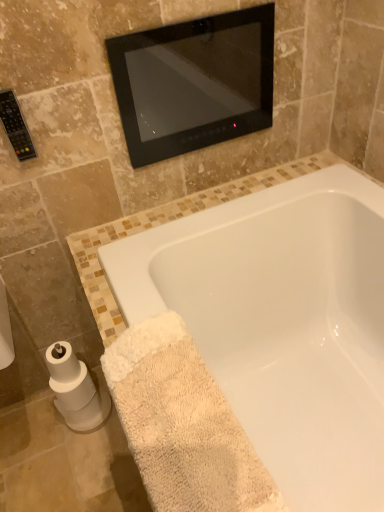
Question: Does beige terry cloth bath towel at lower right have a smaller size compared to white matte toilet paper at lower left?

Choices:
 (A) no
 (B) yes

Answer: (A)

Question: Is beige terry cloth bath towel at lower right positioned with its back to white matte toilet paper at lower left?

Choices:
 (A) yes
 (B) no

Answer: (B)

Question: Can you confirm if beige terry cloth bath towel at lower right is positioned to the left of white matte toilet paper at lower left?

Choices:
 (A) no
 (B) yes

Answer: (A)

Question: Are beige terry cloth bath towel at lower right and white matte toilet paper at lower left far apart?

Choices:
 (A) no
 (B) yes

Answer: (A)

Question: From a real-world perspective, is beige terry cloth bath towel at lower right over white matte toilet paper at lower left?

Choices:
 (A) yes
 (B) no

Answer: (A)

Question: Considering the relative sizes of beige terry cloth bath towel at lower right and white matte toilet paper at lower left in the image provided, is beige terry cloth bath towel at lower right taller than white matte toilet paper at lower left?

Choices:
 (A) no
 (B) yes

Answer: (B)

Question: Is white glossy bathtub at lower center facing away from white matte toilet paper at lower left?

Choices:
 (A) no
 (B) yes

Answer: (A)

Question: Is white matte toilet paper at lower left located within white glossy bathtub at lower center?

Choices:
 (A) yes
 (B) no

Answer: (B)

Question: Does white glossy bathtub at lower center have a smaller size compared to white matte toilet paper at lower left?

Choices:
 (A) yes
 (B) no

Answer: (B)

Question: Does white glossy bathtub at lower center have a greater height compared to white matte toilet paper at lower left?

Choices:
 (A) yes
 (B) no

Answer: (A)

Question: Is white glossy bathtub at lower center not inside white matte toilet paper at lower left?

Choices:
 (A) no
 (B) yes

Answer: (B)

Question: Is white glossy bathtub at lower center bigger than white matte toilet paper at lower left?

Choices:
 (A) yes
 (B) no

Answer: (A)

Question: Is beige terry cloth bath towel at lower right bigger than black glass mirror at upper center?

Choices:
 (A) yes
 (B) no

Answer: (A)